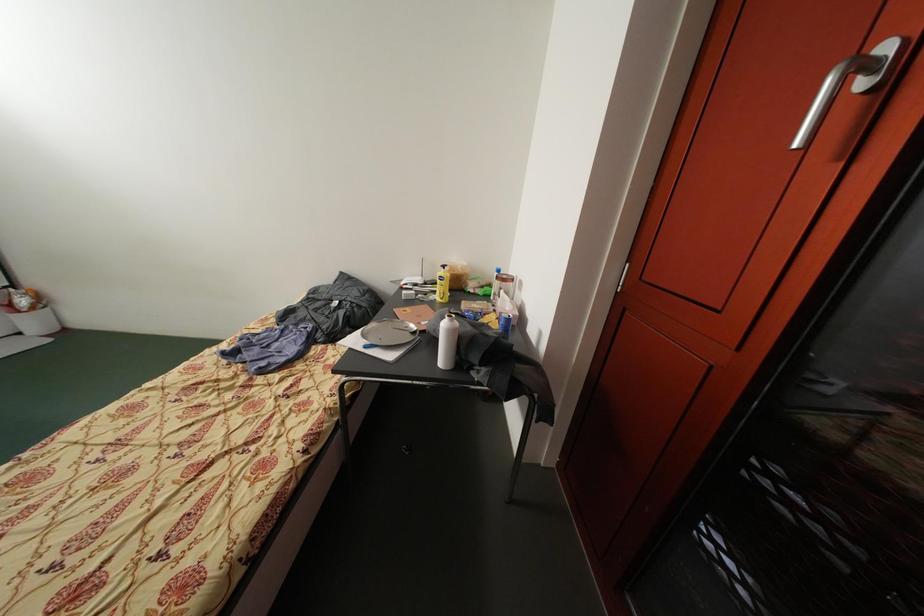
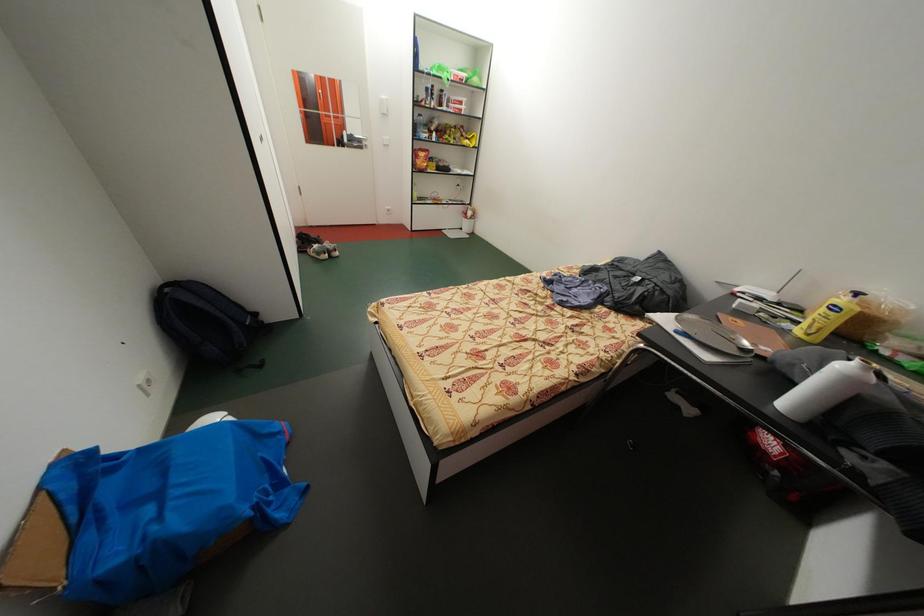
First-person continuous shooting, in which direction is the camera rotating?

The camera's rotation is toward left-down.